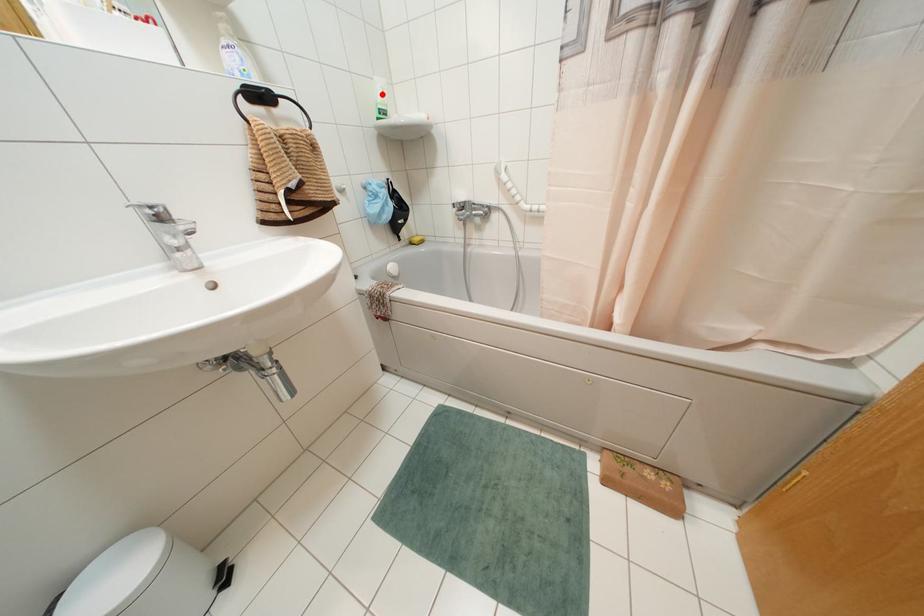
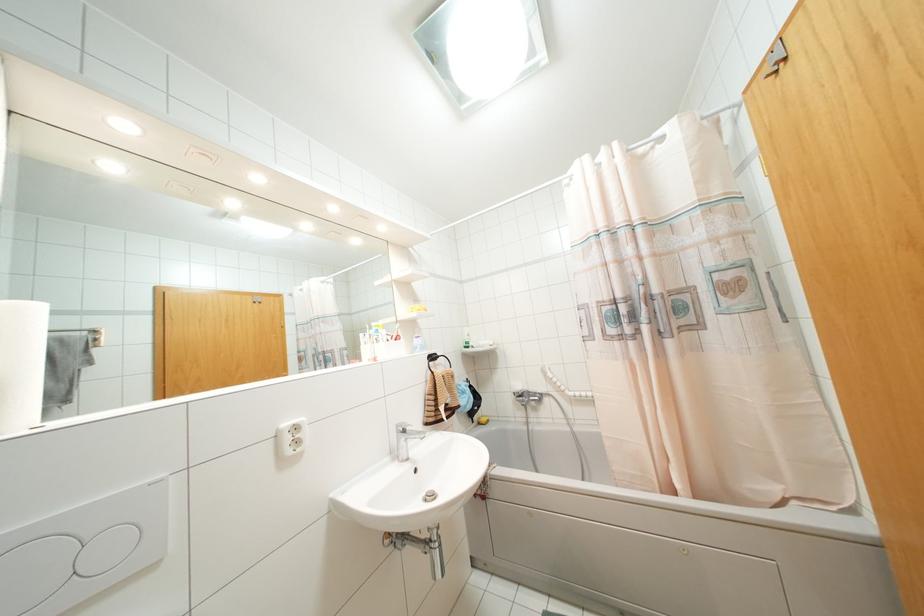
Where in the second image is the point corresponding to the highlighted location from the first image?

(468, 334)